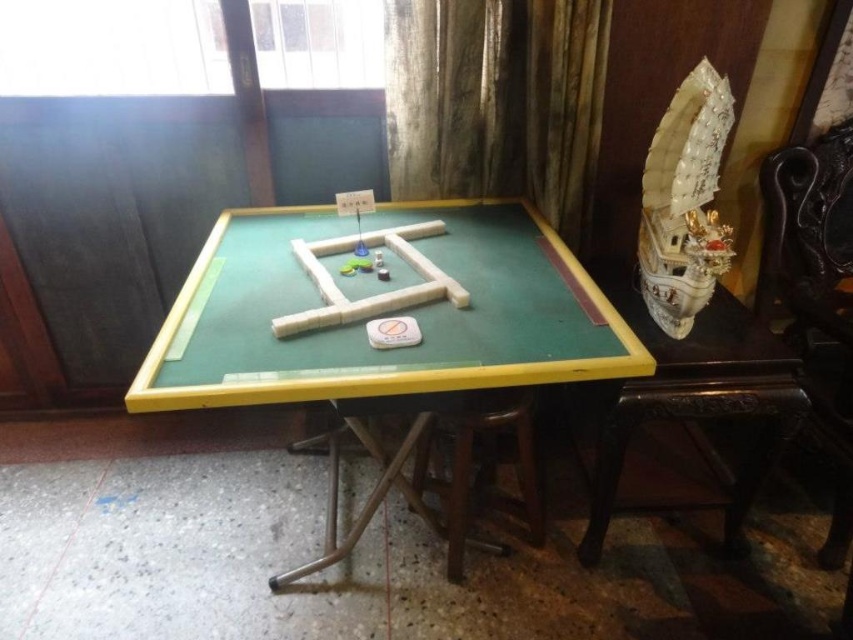
Measure the distance between wooden stool at lower center and camera.

A distance of 4.62 feet exists between wooden stool at lower center and camera.

Can you confirm if wooden stool at lower center is wider than white matte wooden blocks at center?

In fact, wooden stool at lower center might be narrower than white matte wooden blocks at center.

Identify the location of wooden stool at lower center. This screenshot has height=640, width=853. (473, 461).

Who is more forward, (645, 218) or (498, 422)?

Point (498, 422) is in front.

Where is `ivory textured ship at upper right`? ivory textured ship at upper right is located at coordinates (683, 202).

Is ivory textured ship at upper right bigger than white matte wooden blocks at center?

No.

Can you confirm if ivory textured ship at upper right is taller than white matte wooden blocks at center?

Yes, ivory textured ship at upper right is taller than white matte wooden blocks at center.

This screenshot has height=640, width=853. What do you see at coordinates (683, 202) in the screenshot?
I see `ivory textured ship at upper right` at bounding box center [683, 202].

Find the location of a particular element. This screenshot has width=853, height=640. ivory textured ship at upper right is located at coordinates (683, 202).